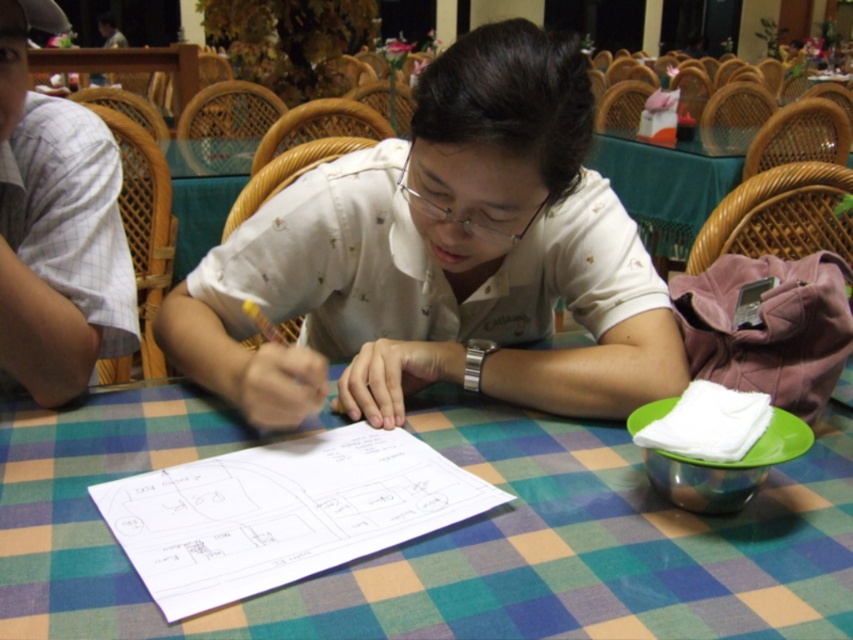
Can you confirm if white matte shirt at center is positioned above white checkered shirt at left?

Actually, white matte shirt at center is below white checkered shirt at left.

Which is in front, point (346, 273) or point (22, 259)?

Point (22, 259) is more forward.

You are a GUI agent. You are given a task and a screenshot of the screen. Output one action in this format:
    pyautogui.click(x=<x>, y=<y>)
    Task: Click on the white matte shirt at center
    The image size is (853, 640).
    Given the screenshot: What is the action you would take?
    (x=440, y=259)

Is green checkered tablecloth at center above white matte shirt at center?

Incorrect, green checkered tablecloth at center is not positioned above white matte shirt at center.

Does point (566, 572) lie behind point (595, 362)?

No, it is in front of (595, 362).

Where is `green checkered tablecloth at center`? The height and width of the screenshot is (640, 853). green checkered tablecloth at center is located at coordinates (439, 534).

Which of these two, white paper at center or white checkered shirt at left, stands taller?

With more height is white checkered shirt at left.

At what (x,y) coordinates should I click in order to perform the action: click on white paper at center. Please return your answer as a coordinate pair (x, y). Looking at the image, I should click on (282, 513).

The image size is (853, 640). I want to click on white paper at center, so click(282, 513).